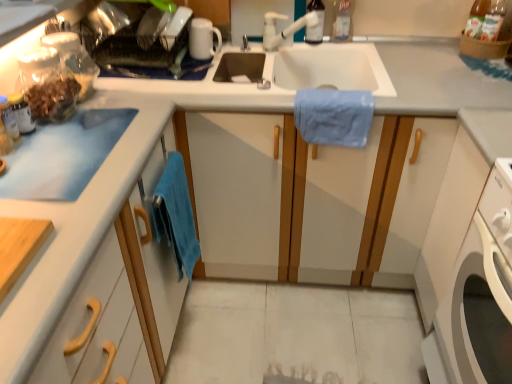
Question: Is transparent plastic bottle at upper center, the first bottle from the left, aimed at white plastic faucet at upper center?

Choices:
 (A) no
 (B) yes

Answer: (B)

Question: Does transparent plastic bottle at upper center, which is counted as the 2th bottle, starting from the right, appear on the left side of white plastic faucet at upper center?

Choices:
 (A) yes
 (B) no

Answer: (B)

Question: From the image's perspective, would you say transparent plastic bottle at upper center, which is counted as the 2th bottle, starting from the right, is positioned over white plastic faucet at upper center?

Choices:
 (A) no
 (B) yes

Answer: (B)

Question: Considering the relative sizes of transparent plastic bottle at upper center, the first bottle from the left, and white plastic faucet at upper center in the image provided, is transparent plastic bottle at upper center, the first bottle from the left, thinner than white plastic faucet at upper center?

Choices:
 (A) no
 (B) yes

Answer: (B)

Question: Is transparent plastic bottle at upper center, the first bottle from the left, positioned in front of white plastic faucet at upper center?

Choices:
 (A) yes
 (B) no

Answer: (B)

Question: Looking at the image, does white plastic washing machine at lower right seem bigger or smaller compared to white plastic faucet at upper center?

Choices:
 (A) small
 (B) big

Answer: (B)

Question: Is white plastic washing machine at lower right in front of or behind white plastic faucet at upper center in the image?

Choices:
 (A) front
 (B) behind

Answer: (A)

Question: In terms of width, does white plastic washing machine at lower right look wider or thinner when compared to white plastic faucet at upper center?

Choices:
 (A) thin
 (B) wide

Answer: (B)

Question: In terms of height, does white plastic washing machine at lower right look taller or shorter compared to white plastic faucet at upper center?

Choices:
 (A) tall
 (B) short

Answer: (A)

Question: Is blue cotton towel at center, which appears as the second bath towel when viewed from the left, taller or shorter than white glossy mug at upper center?

Choices:
 (A) short
 (B) tall

Answer: (B)

Question: Is point (365, 97) closer or farther from the camera than point (201, 31)?

Choices:
 (A) closer
 (B) farther

Answer: (A)

Question: Is blue cotton towel at center, which is counted as the first bath towel, starting from the right, in front of or behind white glossy mug at upper center in the image?

Choices:
 (A) front
 (B) behind

Answer: (A)

Question: Is blue cotton towel at center, which is the 2th bath towel in bottom-to-top order, wider or thinner than white glossy mug at upper center?

Choices:
 (A) wide
 (B) thin

Answer: (A)

Question: Is matte plastic container at upper left in front of or behind white plastic faucet at upper center in the image?

Choices:
 (A) behind
 (B) front

Answer: (B)

Question: Is matte plastic container at upper left spatially inside white plastic faucet at upper center, or outside of it?

Choices:
 (A) outside
 (B) inside

Answer: (A)